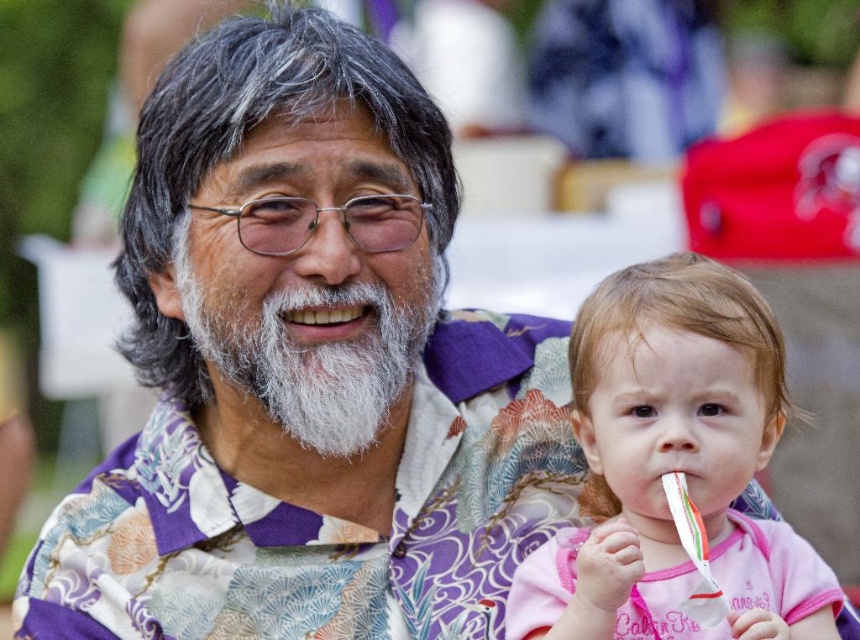
Question: Does white matte beard at center appear on the right side of white matte teeth at center?

Choices:
 (A) yes
 (B) no

Answer: (B)

Question: Which object is closer to the camera taking this photo?

Choices:
 (A) white matte beard at center
 (B) pink fabric at center
 (C) white matte teeth at center
 (D) white plastic toothbrush at lower right

Answer: (B)

Question: Which object is positioned farthest from the white matte beard at center?

Choices:
 (A) white matte teeth at center
 (B) pink fabric at center

Answer: (B)

Question: Is pink fabric at center smaller than white plastic toothbrush at lower right?

Choices:
 (A) yes
 (B) no

Answer: (B)

Question: Which point appears farthest from the camera in this image?

Choices:
 (A) (430, 252)
 (B) (329, 340)
 (C) (707, 621)
 (D) (742, 476)

Answer: (A)

Question: Is pink fabric at center smaller than white matte beard at center?

Choices:
 (A) yes
 (B) no

Answer: (B)